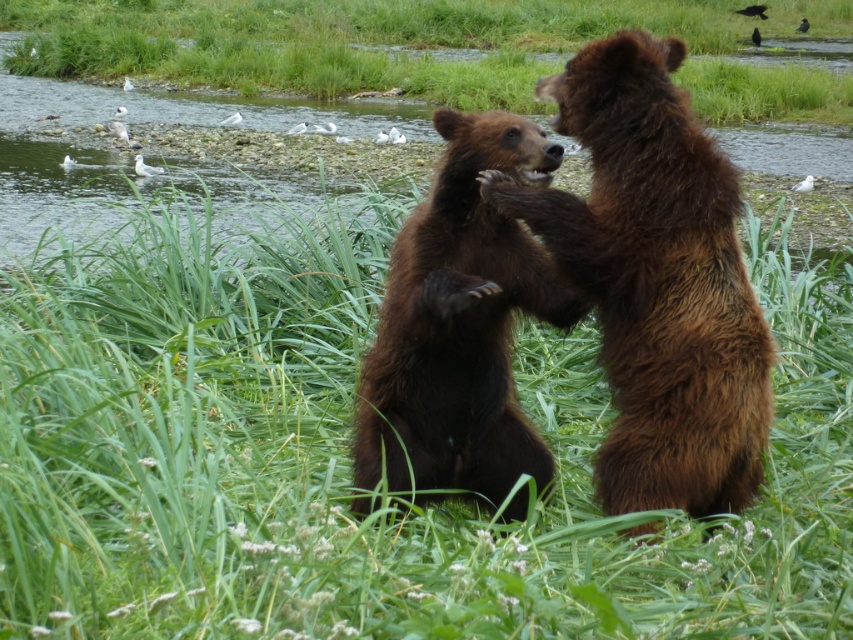
You are standing in the scene and want to place a small treat between the two points, point 1 at point (679, 225) and point 2 at point (537, 252). Which point is closer to you so you can place the treat there?

Point (679, 225) is closer to the viewer than point (537, 252), so you should place the treat at point (679, 225).

You are standing at the point marked as point (350, 460) in the image. Looking around, you see the green grassy at center. Can you tell me what is located exactly at the point you are standing on?

The point (350, 460) is exactly where the green grassy at center is located.